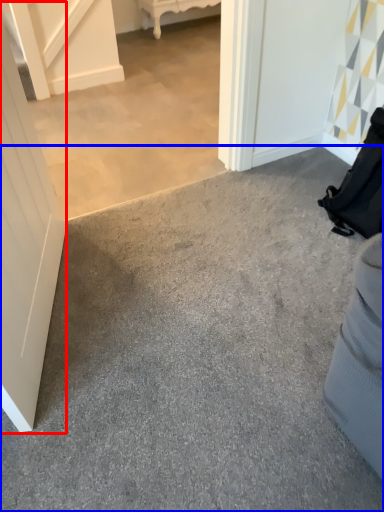
Question: Which object is closer to the camera taking this photo, door (highlighted by a red box) or concrete (highlighted by a blue box)?

Choices:
 (A) door
 (B) concrete

Answer: (A)